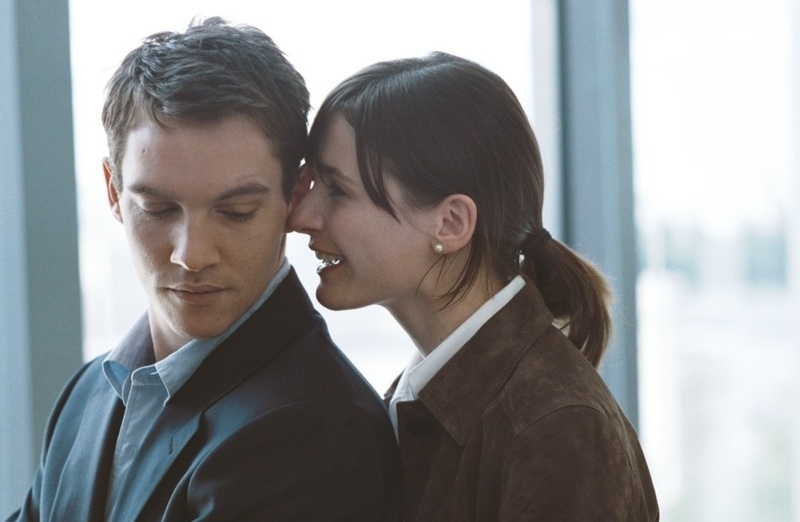
You are a GUI agent. You are given a task and a screenshot of the screen. Output one action in this format:
    pyautogui.click(x=<x>, y=<y>)
    Task: Click on the dark spot ob window
    
    Given the screenshot: What is the action you would take?
    point(689,259)